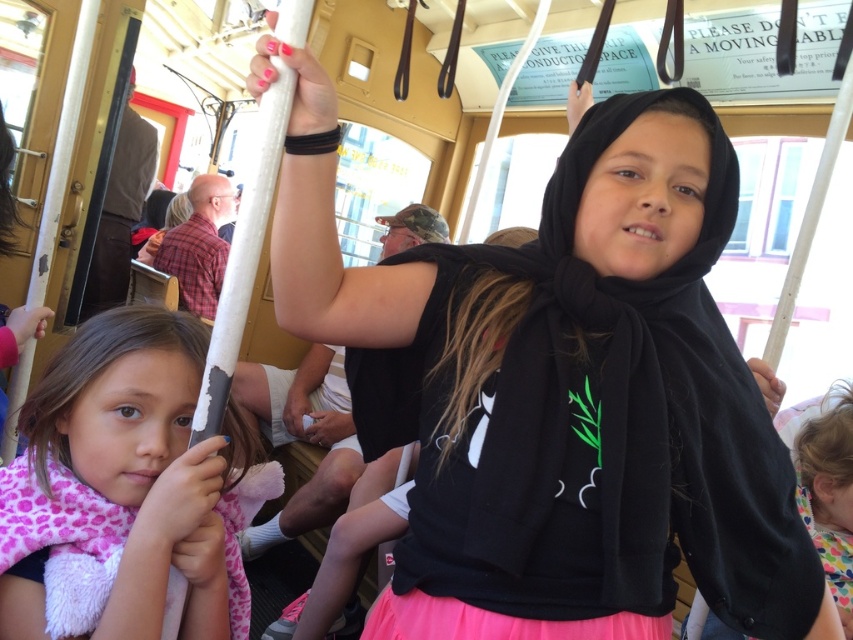
Question: Which point is closer to the camera?

Choices:
 (A) pink fleece scarf at left
 (B) brown leather coach at left
 (C) black matte scarf at upper center
 (D) pink fabric at center

Answer: (C)

Question: Does pink fleece scarf at left have a smaller size compared to brown leather coach at left?

Choices:
 (A) no
 (B) yes

Answer: (B)

Question: Which object is closer to the camera taking this photo?

Choices:
 (A) pink fabric at lower right
 (B) pink fabric at center

Answer: (B)

Question: Estimate the real-world distances between objects in this image. Which object is closer to the pink fleece scarf at left?

Choices:
 (A) brown leather coach at left
 (B) black matte scarf at upper center
 (C) pink fabric at center
 (D) plaid fabric coach at center

Answer: (B)

Question: Considering the relative positions of black matte scarf at upper center and plaid fabric coach at center in the image provided, where is black matte scarf at upper center located with respect to plaid fabric coach at center?

Choices:
 (A) left
 (B) right

Answer: (B)

Question: Can you confirm if black matte scarf at upper center is smaller than pink fabric at center?

Choices:
 (A) no
 (B) yes

Answer: (A)